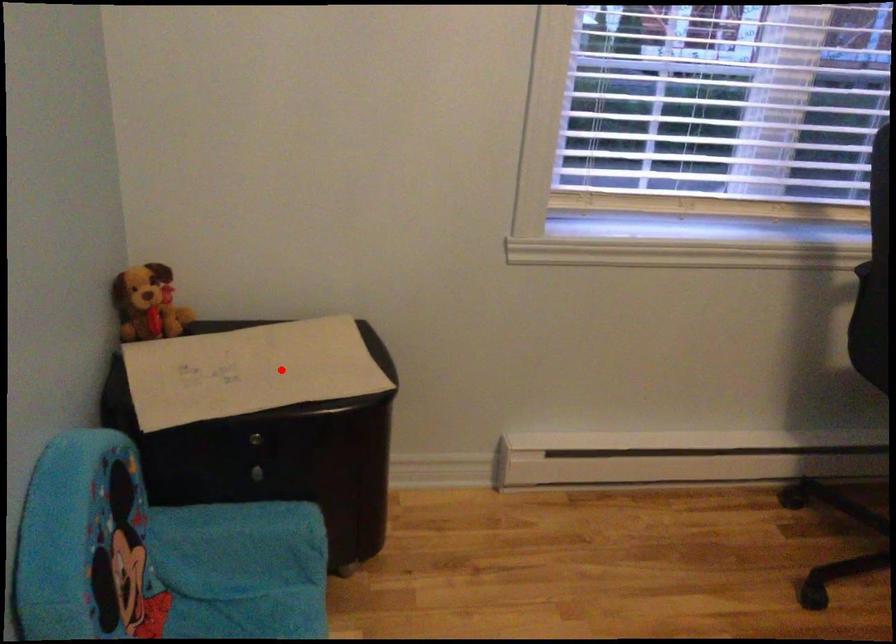
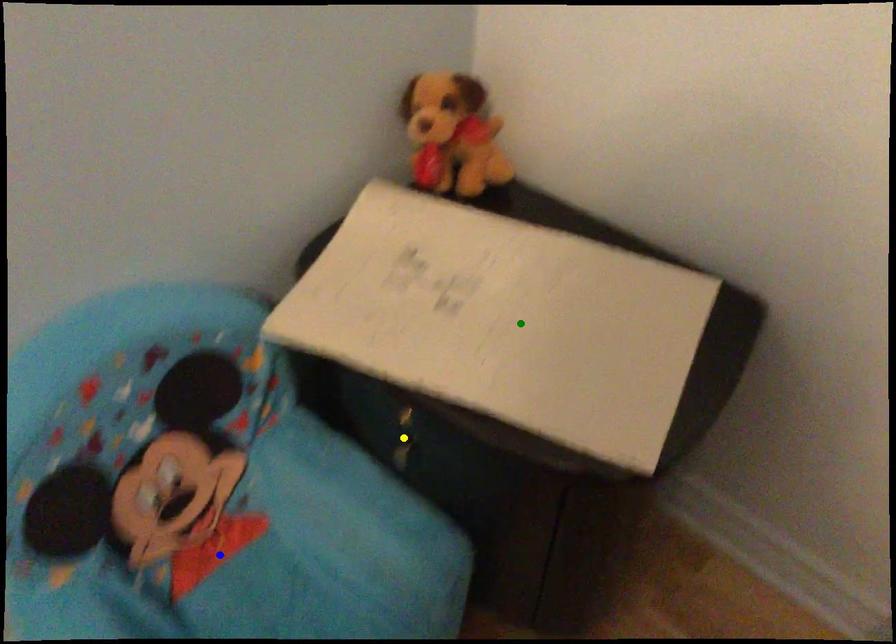
Question: I am providing you with two images of the same scene from different viewpoints. A red point is marked on the first image. You are given multiple points on the second image. In image 2, which mark is for the same physical point as the one in image 1?

Choices:
 (A) blue point
 (B) green point
 (C) yellow point

Answer: (B)